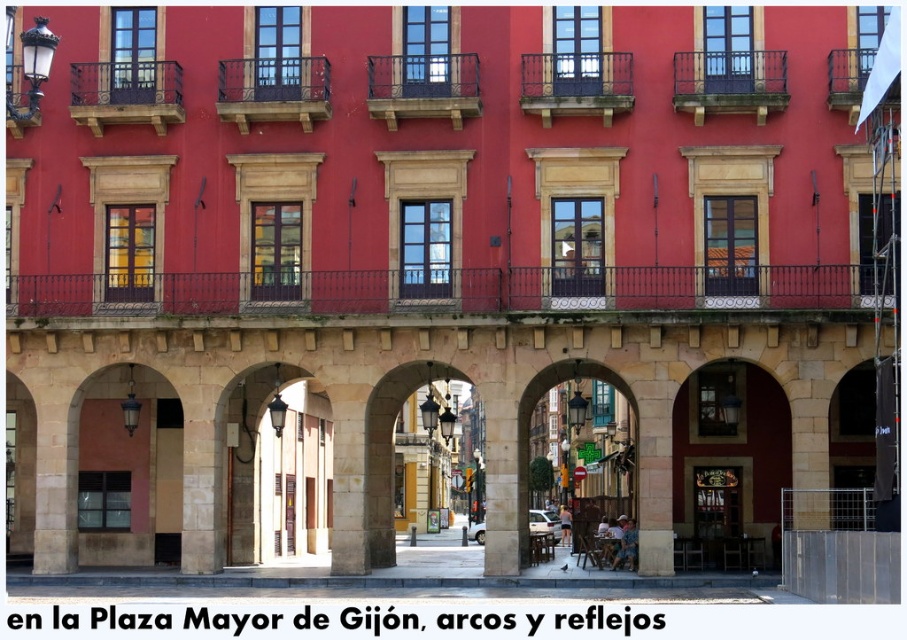
Question: Does rustic wrought iron balcony at upper left appear under polished wood balcony at upper center?

Choices:
 (A) no
 (B) yes

Answer: (A)

Question: Is sandy stone column at center to the left of rustic wrought iron balcony at upper left from the viewer's perspective?

Choices:
 (A) no
 (B) yes

Answer: (A)

Question: Which of the following is the farthest from the observer?

Choices:
 (A) (631, 81)
 (B) (698, 77)

Answer: (A)

Question: Which object is positioned closest to the matte black balcony at center?

Choices:
 (A) dark brown wrought iron balcony at upper right
 (B) brown stone archway at center
 (C) smooth stone pillar at center

Answer: (A)

Question: Is matte black balcony at center thinner than dark brown wrought iron balcony at upper right?

Choices:
 (A) no
 (B) yes

Answer: (B)

Question: Based on their relative distances, which object is nearer to the metallic black balcony at upper right?

Choices:
 (A) dark brown wrought iron balcony at upper center
 (B) brown stone archway at center
 (C) polished wrought iron balcony at center
 (D) polished wood balcony at upper center

Answer: (D)